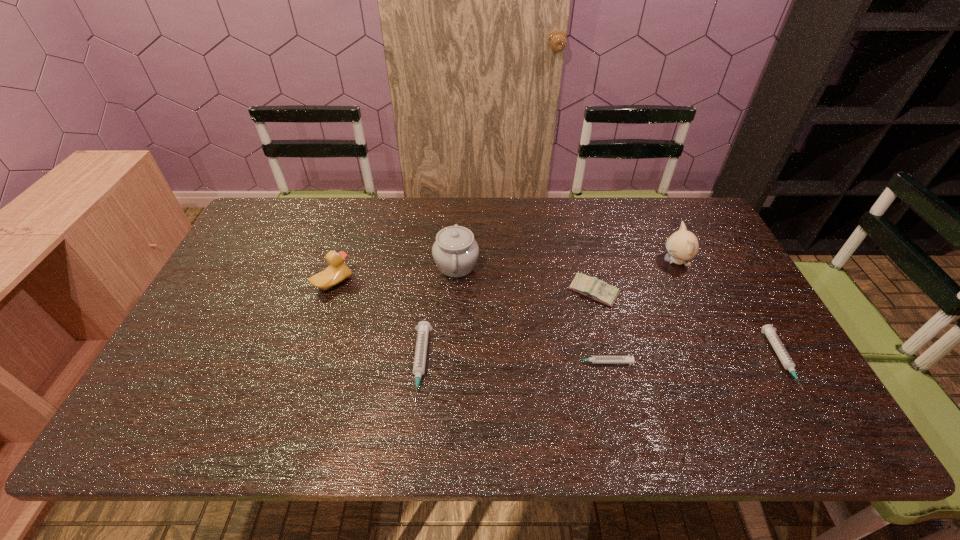
Please show where to add a syringe on the left while keeping spacing even. Please provide its 2D coordinates. Your answer should be formatted as a tuple, i.e. [(x, y)], where the tuple contains the x and y coordinates of a point satisfying the conditions above.

[(238, 366)]